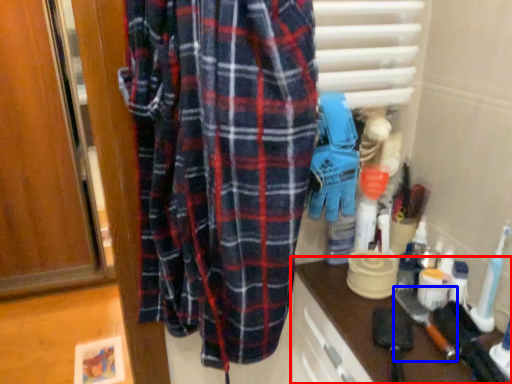
Question: Which object is closer to the camera taking this photo, counter (highlighted by a red box) or brush (highlighted by a blue box)?

Choices:
 (A) counter
 (B) brush

Answer: (A)